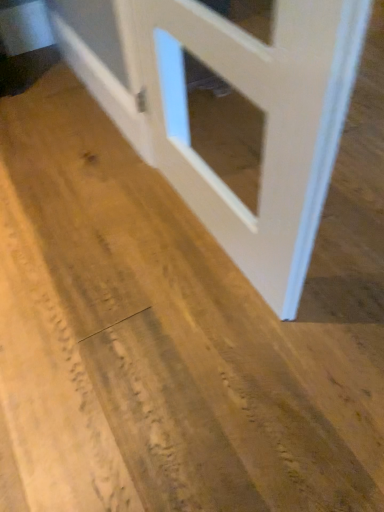
What are the coordinates of `white glossy door at center` in the screenshot? It's located at (264, 126).

The image size is (384, 512). What do you see at coordinates (264, 126) in the screenshot?
I see `white glossy door at center` at bounding box center [264, 126].

Image resolution: width=384 pixels, height=512 pixels. What are the coordinates of `white glossy door at center` in the screenshot? It's located at 264,126.